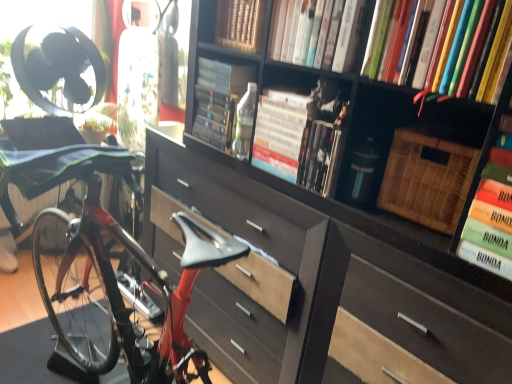
Question: From a real-world perspective, is hardcover book at upper center, arranged as the 4th book when viewed from the left, beneath green matte book at right, the 1th book viewed from the right?

Choices:
 (A) no
 (B) yes

Answer: (A)

Question: From the image's perspective, is hardcover book at upper center, arranged as the 4th book when viewed from the left, below green matte book at right, the 1th book viewed from the right?

Choices:
 (A) no
 (B) yes

Answer: (A)

Question: From the image's perspective, does hardcover book at upper center, arranged as the 4th book when viewed from the left, appear higher than green matte book at right, arranged as the seventh book when viewed from the left?

Choices:
 (A) yes
 (B) no

Answer: (A)

Question: Can you confirm if hardcover book at upper center, arranged as the 4th book when viewed from the left, is shorter than green matte book at right, arranged as the seventh book when viewed from the left?

Choices:
 (A) no
 (B) yes

Answer: (B)

Question: Is hardcover book at upper center, the fourth book when ordered from right to left, further to the viewer compared to green matte book at right, the 1th book viewed from the right?

Choices:
 (A) no
 (B) yes

Answer: (B)

Question: Considering the positions of hardcover books at upper right, which is the second book from right to left, and hardcover book at center, the third book when ordered from right to left, in the image, is hardcover books at upper right, which is the second book from right to left, bigger or smaller than hardcover book at center, the third book when ordered from right to left,?

Choices:
 (A) big
 (B) small

Answer: (A)

Question: From a real-world perspective, is hardcover books at upper right, which is the second book from right to left, positioned above or below hardcover book at center, the third book when ordered from right to left?

Choices:
 (A) above
 (B) below

Answer: (A)

Question: From the image's perspective, is hardcover books at upper right, the 6th book in the left-to-right sequence, located above or below hardcover book at center, arranged as the 5th book when viewed from the left?

Choices:
 (A) below
 (B) above

Answer: (B)

Question: Is hardcover books at upper right, which is the second book from right to left, wider or thinner than hardcover book at center, arranged as the 5th book when viewed from the left?

Choices:
 (A) thin
 (B) wide

Answer: (A)

Question: In terms of height, does hardcover books at upper right, which is the second book from right to left, look taller or shorter compared to hardcover book at center, which is the 1th book from left to right?

Choices:
 (A) tall
 (B) short

Answer: (B)

Question: Is hardcover books at upper right, the 6th book in the left-to-right sequence, in front of or behind hardcover book at center, which is the 1th book from left to right, in the image?

Choices:
 (A) behind
 (B) front

Answer: (B)

Question: From a real-world perspective, is hardcover books at upper right, which is the second book from right to left, physically located above or below hardcover book at center, marked as the 7th book in a right-to-left arrangement?

Choices:
 (A) above
 (B) below

Answer: (A)

Question: From the image's perspective, is hardcover books at upper right, the 6th book in the left-to-right sequence, positioned above or below hardcover book at center, marked as the 7th book in a right-to-left arrangement?

Choices:
 (A) below
 (B) above

Answer: (B)

Question: From a real-world perspective, is shiny red bicycle at left positioned above or below hardcover book at upper center, which ranks as the 3th book in left-to-right order?

Choices:
 (A) above
 (B) below

Answer: (B)

Question: Is point pos(95,69) closer or farther from the camera than point pos(289,102)?

Choices:
 (A) farther
 (B) closer

Answer: (A)